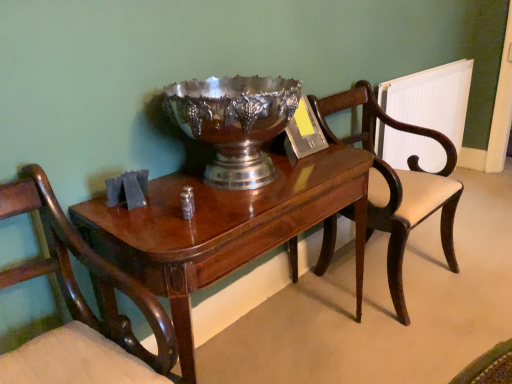
Question: Is mahogany wood table at center positioned in front of mahogany wood chair at left, positioned as the 1th chair in front-to-back order?

Choices:
 (A) yes
 (B) no

Answer: (B)

Question: Is mahogany wood table at center shorter than mahogany wood chair at left, the 2th chair positioned from the back?

Choices:
 (A) no
 (B) yes

Answer: (B)

Question: Is mahogany wood table at center far from mahogany wood chair at left, which is the 2th chair from right to left?

Choices:
 (A) yes
 (B) no

Answer: (B)

Question: From the image's perspective, would you say mahogany wood table at center is shown under mahogany wood chair at left, positioned as the 1th chair in front-to-back order?

Choices:
 (A) no
 (B) yes

Answer: (A)

Question: From a real-world perspective, is mahogany wood table at center physically above mahogany wood chair at left, which is the 2th chair from right to left?

Choices:
 (A) no
 (B) yes

Answer: (A)

Question: From the image's perspective, relative to mahogany wood chair at left, which is the 1th chair in left-to-right order, is mahogany wood table at center above or below?

Choices:
 (A) below
 (B) above

Answer: (B)

Question: Is mahogany wood table at center bigger or smaller than mahogany wood chair at left, the 2th chair positioned from the back?

Choices:
 (A) small
 (B) big

Answer: (B)

Question: From their relative heights in the image, would you say mahogany wood table at center is taller or shorter than mahogany wood chair at left, positioned as the 1th chair in front-to-back order?

Choices:
 (A) tall
 (B) short

Answer: (B)

Question: Is mahogany wood table at center inside the boundaries of mahogany wood chair at left, which is the 1th chair in left-to-right order, or outside?

Choices:
 (A) inside
 (B) outside

Answer: (B)

Question: Is mahogany wood chair at left, which is the 2th chair from right to left, inside or outside of white plastic radiator at right?

Choices:
 (A) inside
 (B) outside

Answer: (B)

Question: Looking at their shapes, would you say mahogany wood chair at left, which is the 2th chair from right to left, is wider or thinner than white plastic radiator at right?

Choices:
 (A) wide
 (B) thin

Answer: (A)

Question: Would you say mahogany wood chair at left, positioned as the 1th chair in front-to-back order, is to the left or to the right of white plastic radiator at right in the picture?

Choices:
 (A) left
 (B) right

Answer: (A)

Question: Does point (40, 196) appear closer or farther from the camera than point (435, 150)?

Choices:
 (A) farther
 (B) closer

Answer: (B)

Question: Is point (409, 321) positioned closer to the camera than point (73, 276)?

Choices:
 (A) closer
 (B) farther

Answer: (B)

Question: Is mahogany wood chair at right, the 1th chair from the back, in front of or behind mahogany wood chair at left, which is the 1th chair in left-to-right order, in the image?

Choices:
 (A) front
 (B) behind

Answer: (B)